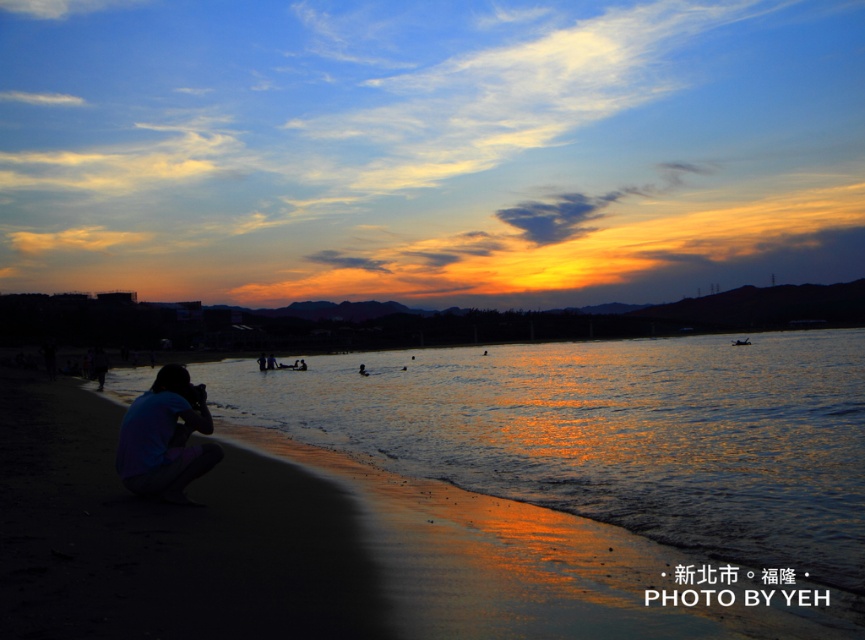
You are standing at the point where the photographer is crouched on the wet sand. Looking towards the glistening water at lower left located at point (612, 433), will you see the sunset in your line of sight?

Yes, because the glistening water at lower left is located at point (612, 433), which is in the direction of the sunset, so the sunset will be in your line of sight.

You are standing on the beach and notice the glistening water at lower left and the blue cotton shirt at lower left. Which object is wider from your perspective?

The glistening water at lower left might be wider than the blue cotton shirt at lower left.